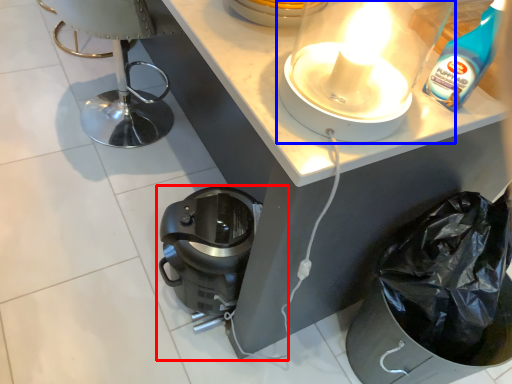
Question: Which of the following is the farthest to the observer, home appliance (highlighted by a red box) or kitchen appliance (highlighted by a blue box)?

Choices:
 (A) home appliance
 (B) kitchen appliance

Answer: (A)